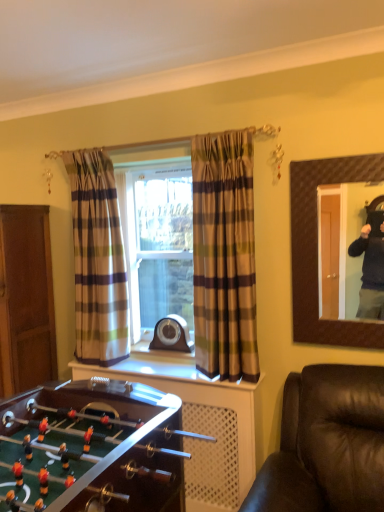
Question: Considering the positions of point (198, 457) and point (104, 245), is point (198, 457) closer or farther from the camera than point (104, 245)?

Choices:
 (A) farther
 (B) closer

Answer: (B)

Question: Is brown wooden dresser at lower left in front of or behind plaid fabric curtain at left, marked as the first curtain in a left-to-right arrangement, in the image?

Choices:
 (A) behind
 (B) front

Answer: (B)

Question: Which object is the farthest from the brown wooden door at left?

Choices:
 (A) brown wooden dresser at lower left
 (B) brown plaid curtain at center, the 2th curtain positioned from the back
 (C) brown textured mirror at upper right
 (D) plaid fabric curtain at left, acting as the 2th curtain starting from the right

Answer: (C)

Question: Considering the real-world distances, which object is farthest from the plaid fabric curtain at left, acting as the 2th curtain starting from the right?

Choices:
 (A) brown wooden door at left
 (B) brown plaid curtain at center, the first curtain when ordered from front to back
 (C) brown wooden dresser at lower left
 (D) brown textured mirror at upper right

Answer: (D)